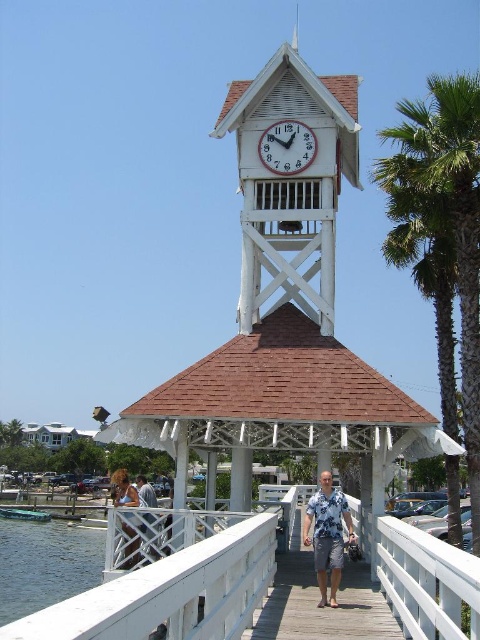
Is wooden bridge at center wider than light blue shirt at center?

In fact, wooden bridge at center might be narrower than light blue shirt at center.

Where is `wooden bridge at center`? The image size is (480, 640). wooden bridge at center is located at coordinates (316, 602).

Locate an element on the screen. This screenshot has width=480, height=640. wooden bridge at center is located at coordinates (316, 602).

Between white wood gazebo at center and white wooden clock tower at center, which one has more height?

Standing taller between the two is white wood gazebo at center.

Between white wood gazebo at center and white wooden clock tower at center, which one has less height?

With less height is white wooden clock tower at center.

Is point (219, 435) more distant than point (249, 225)?

That is False.

At what (x,y) coordinates should I click in order to perform the action: click on white wood gazebo at center. Please return your answer as a coordinate pair (x, y). The height and width of the screenshot is (640, 480). Looking at the image, I should click on (285, 316).

Is point (324, 250) positioned before point (304, 632)?

No, (324, 250) is behind (304, 632).

Is white wooden clock tower at center bigger than wooden bridge at center?

Yes, white wooden clock tower at center is bigger than wooden bridge at center.

Who is more distant from viewer, [290,280] or [323,625]?

The point [290,280] is behind.

The height and width of the screenshot is (640, 480). I want to click on white wooden clock tower at center, so click(x=290, y=180).